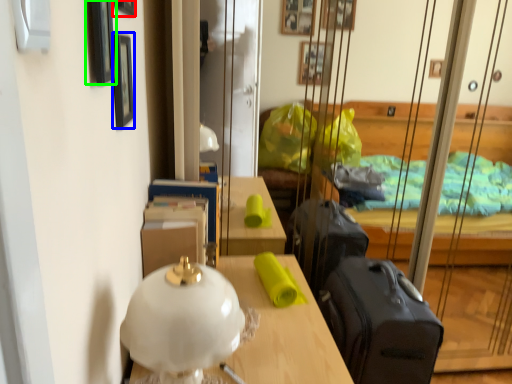
Question: Based on their relative distances, which object is nearer to picture frame (highlighted by a red box)? Choose from picture frame (highlighted by a blue box) and picture frame (highlighted by a green box).

Choices:
 (A) picture frame
 (B) picture frame

Answer: (A)